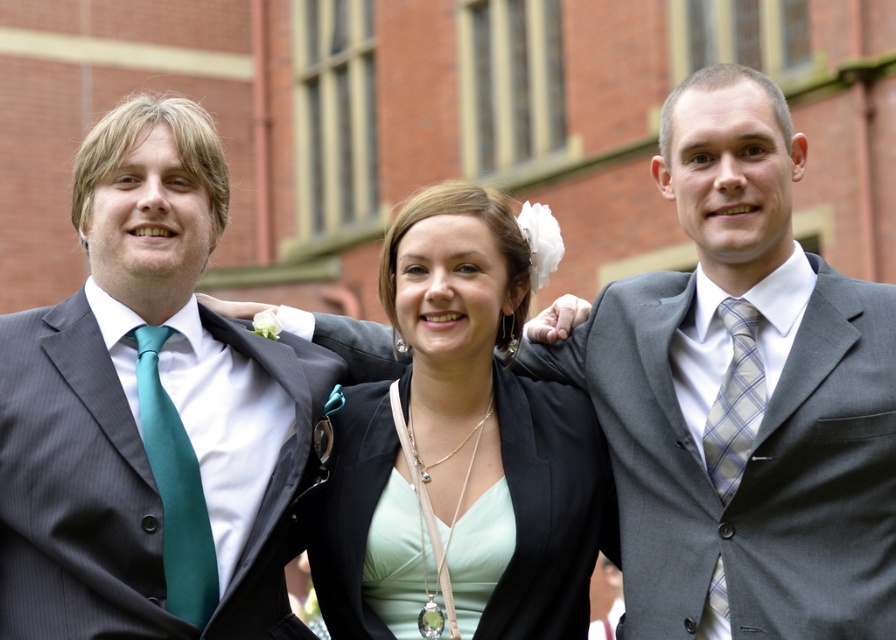
What do you see at coordinates (149, 412) in the screenshot? I see `matte black suit at left` at bounding box center [149, 412].

Can you confirm if matte black suit at left is thinner than matte black blazer at center?

No, matte black suit at left is not thinner than matte black blazer at center.

I want to click on matte black suit at left, so click(149, 412).

Does point (123, 456) come behind point (877, 621)?

Yes, point (123, 456) is behind point (877, 621).

The image size is (896, 640). What are the coordinates of `matte black suit at left` in the screenshot? It's located at tap(149, 412).

Is gray wool suit at center positioned at the back of matte black blazer at center?

No, it is in front of matte black blazer at center.

Which is above, gray wool suit at center or matte black blazer at center?

matte black blazer at center is higher up.

Who is more forward, (636, 412) or (416, 509)?

Point (416, 509)

Locate an element on the screen. gray wool suit at center is located at coordinates (746, 460).